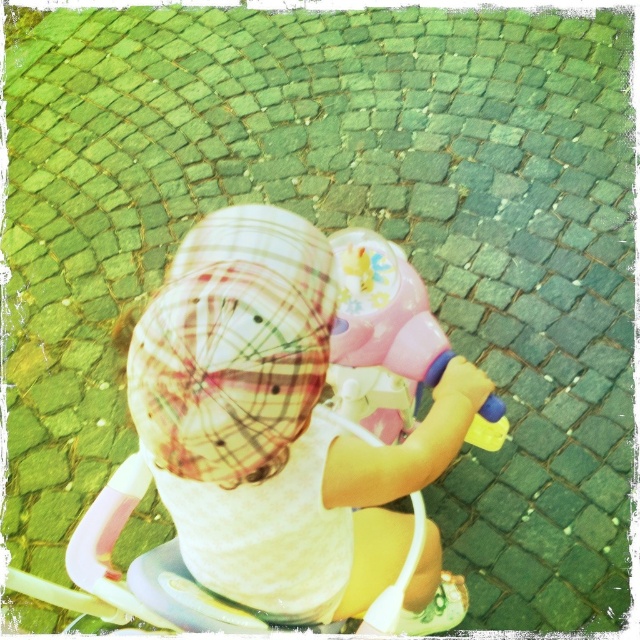
Between white plaid hat at center and pink plastic toy at center, which one appears on the left side from the viewer's perspective?

white plaid hat at center is more to the left.

How distant is white plaid hat at center from pink plastic toy at center?

white plaid hat at center and pink plastic toy at center are 24.09 centimeters apart from each other.

Is point (205, 218) closer to camera compared to point (337, 388)?

No, it is not.

Identify the location of white plaid hat at center. (273, 424).